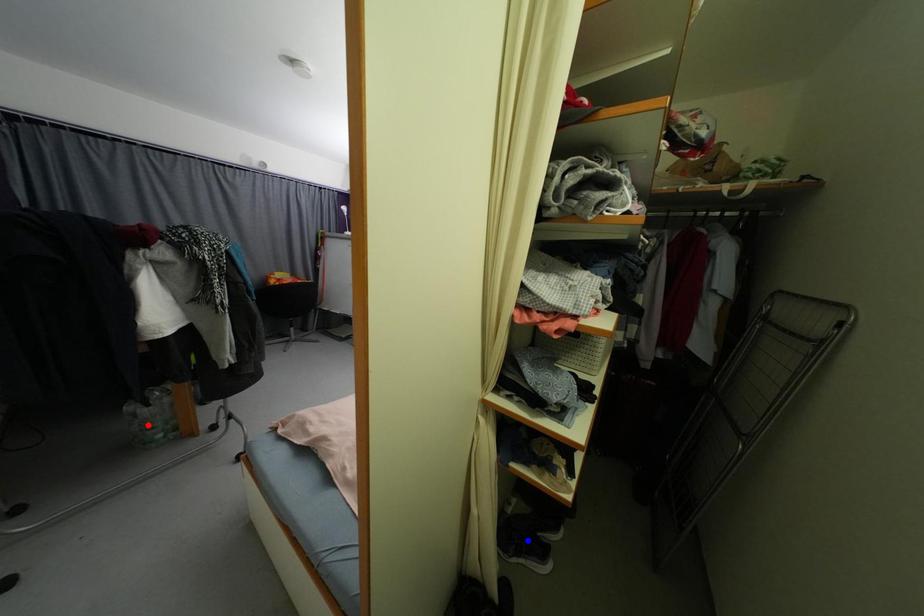
Question: Two points are marked on the image. Which point is closer to the camera?

Choices:
 (A) Blue point is closer.
 (B) Red point is closer.

Answer: (A)